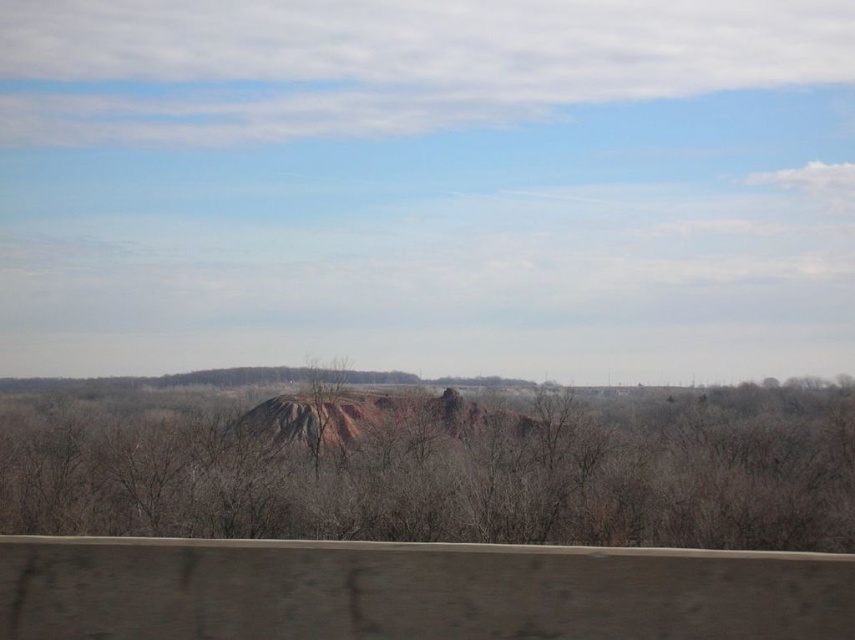
You are a hiker standing at the base of the rustic clay mountain at center and looking towards the brown matte tree at center. Which object is closer to your current position?

The brown matte tree at center is closer to your current position because it is located below the rustic clay mountain at center, meaning it is situated at a lower elevation.